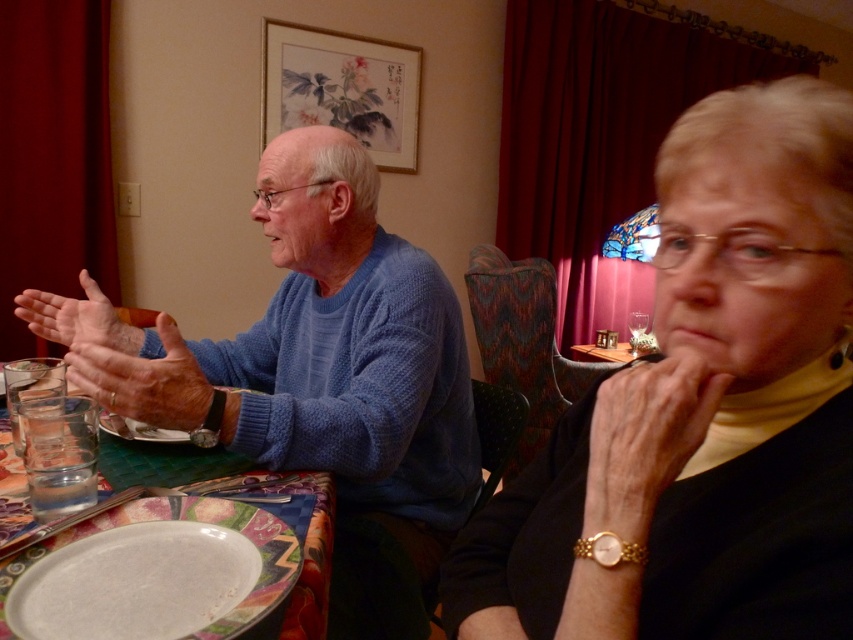
Which is more to the right, matte blue sweater at center or matte ceramic plate at center?

matte ceramic plate at center

Which of these two, matte blue sweater at center or matte ceramic plate at center, stands shorter?

matte ceramic plate at center

I want to click on matte blue sweater at center, so click(x=143, y=380).

Can you confirm if matte ceramic plate at center is bigger than matte blue sweater at left?

Correct, matte ceramic plate at center is larger in size than matte blue sweater at left.

Who is higher up, matte ceramic plate at center or matte blue sweater at left?

matte blue sweater at left

Which is in front, point (15, 472) or point (100, 324)?

Point (15, 472) is in front.

What are the coordinates of `matte ceramic plate at center` in the screenshot? It's located at (309, 556).

Does blue knitted sweater at left have a greater width compared to matte ceramic plate at center?

Yes, blue knitted sweater at left is wider than matte ceramic plate at center.

At what (x,y) coordinates should I click in order to perform the action: click on blue knitted sweater at left. Please return your answer as a coordinate pair (x, y). The width and height of the screenshot is (853, 640). Looking at the image, I should click on (326, 356).

Locate an element on the screen. blue knitted sweater at left is located at coordinates (326, 356).